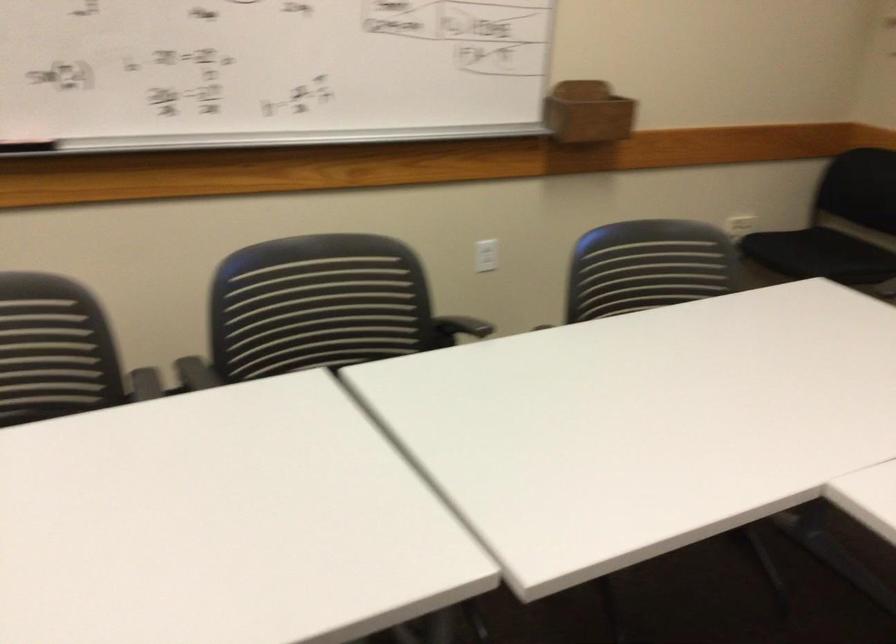
The width and height of the screenshot is (896, 644). Describe the element at coordinates (588, 111) in the screenshot. I see `the wooden marker holder` at that location.